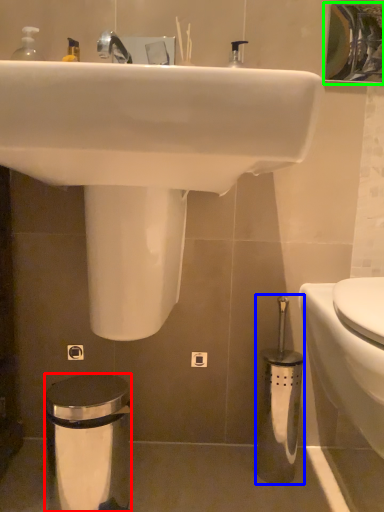
Question: Based on their relative distances, which object is farther from trash bin/can (highlighted by a red box)? Choose from brush (highlighted by a blue box) and mirror (highlighted by a green box).

Choices:
 (A) brush
 (B) mirror

Answer: (B)